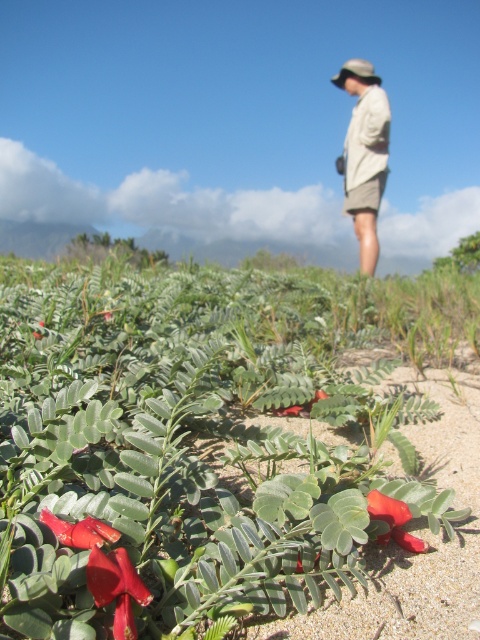
Is smooth red flower at lower left in front of smooth red flower at center?

Yes, it is in front of smooth red flower at center.

Is smooth red flower at lower left below smooth red flower at center?

Correct, smooth red flower at lower left is located below smooth red flower at center.

Is point (131, 625) behind point (319, 388)?

That is False.

You are a GUI agent. You are given a task and a screenshot of the screen. Output one action in this format:
    pyautogui.click(x=<x>, y=<y>)
    Task: Click on the smooth red flower at lower left
    This screenshot has width=480, height=640.
    Given the screenshot: What is the action you would take?
    [x=116, y=588]

Based on the photo, is smooth red flower at lower left smaller than smooth glossy red flower at lower left?

Incorrect, smooth red flower at lower left is not smaller in size than smooth glossy red flower at lower left.

Which is behind, point (121, 557) or point (96, 522)?

The point (96, 522) is behind.

Who is more forward, (108, 588) or (110, 532)?

Positioned in front is point (108, 588).

This screenshot has height=640, width=480. I want to click on smooth red flower at lower left, so click(x=116, y=588).

This screenshot has height=640, width=480. Describe the element at coordinates (394, 520) in the screenshot. I see `bright red matte flower at center` at that location.

Which is in front, point (386, 497) or point (284, 412)?

Positioned in front is point (386, 497).

The width and height of the screenshot is (480, 640). I want to click on bright red matte flower at center, so click(x=394, y=520).